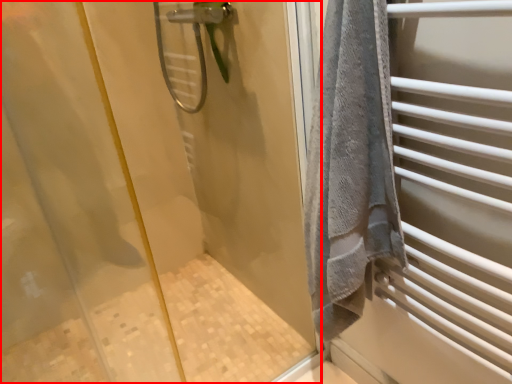
Question: From the image's perspective, considering the relative positions of screen door (annotated by the red box) and shower in the image provided, where is screen door (annotated by the red box) located with respect to the staircase?

Choices:
 (A) below
 (B) above

Answer: (A)